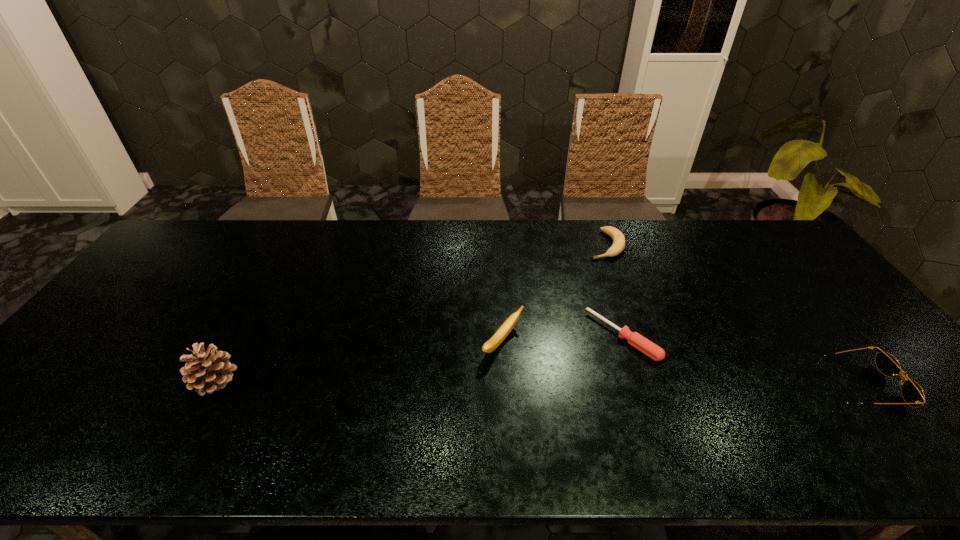
Locate an element on the screen. Image resolution: width=960 pixels, height=540 pixels. free space between the fourth object from right to left and the shorter banana is located at coordinates (554, 294).

Where is `vacant area that lies between the right banana and the sunglasses`? vacant area that lies between the right banana and the sunglasses is located at coordinates (732, 315).

Where is `free space between the leftmost object and the farthest object`? The image size is (960, 540). free space between the leftmost object and the farthest object is located at coordinates (410, 313).

Locate an element on the screen. The height and width of the screenshot is (540, 960). free space that is in between the farther banana and the screwdriver is located at coordinates (613, 291).

At what (x,y) coordinates should I click in order to perform the action: click on blank region between the shortest object and the right banana. Please return your answer as a coordinate pair (x, y). This screenshot has height=540, width=960. Looking at the image, I should click on (613, 291).

Locate an element on the screen. The width and height of the screenshot is (960, 540). free spot between the screwdriver and the sunglasses is located at coordinates (742, 361).

Where is `vacant area between the taller banana and the sunglasses`? The height and width of the screenshot is (540, 960). vacant area between the taller banana and the sunglasses is located at coordinates (682, 364).

I want to click on free space between the second shortest object and the fourth object from right to left, so click(554, 294).

Where is `empty location between the leftmost object and the screwdriver`? This screenshot has width=960, height=540. empty location between the leftmost object and the screwdriver is located at coordinates (419, 359).

This screenshot has height=540, width=960. What are the coordinates of `object that stands as the closest to the sunglasses` in the screenshot? It's located at (636, 340).